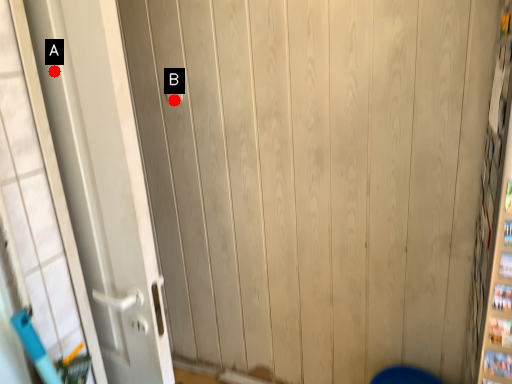
Question: Two points are circled on the image, labeled by A and B beside each circle. Which point is closer to the camera?

Choices:
 (A) A is closer
 (B) B is closer

Answer: (A)